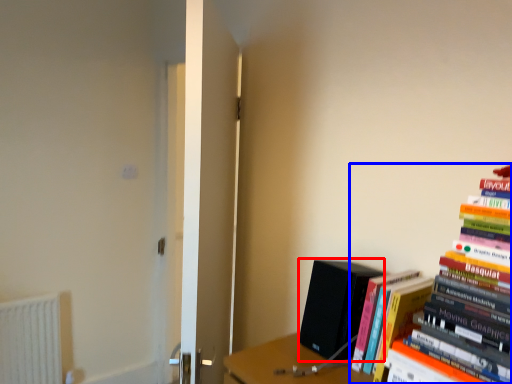
Question: Among these objects, which one is farthest to the camera, paperback book (highlighted by a red box) or book (highlighted by a blue box)?

Choices:
 (A) paperback book
 (B) book

Answer: (A)